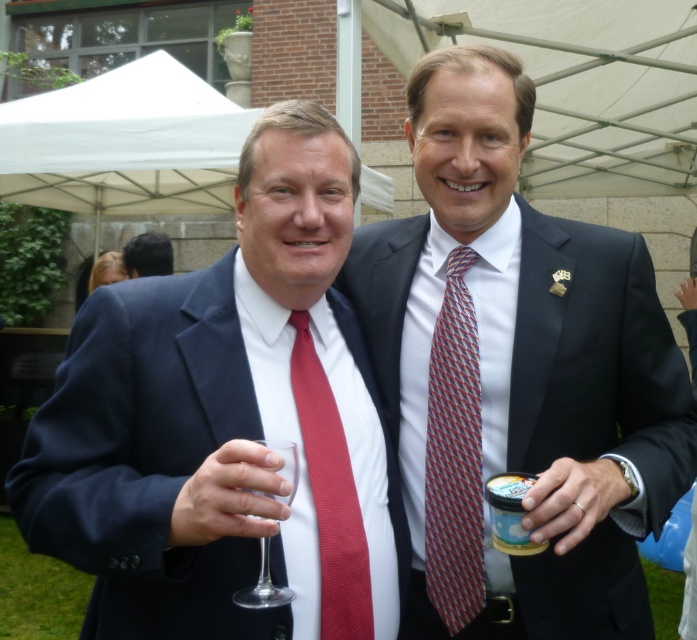
Question: Is matte black suit at center bigger than white plastic cup at right?

Choices:
 (A) yes
 (B) no

Answer: (A)

Question: Which of the following is the farthest from the observer?

Choices:
 (A) matte red tie at left
 (B) multicolored woven tie at center
 (C) white plastic cup at right

Answer: (B)

Question: Is matte red tie at left bigger than matte black suit at center?

Choices:
 (A) no
 (B) yes

Answer: (A)

Question: Which of the following is the closest to the observer?

Choices:
 (A) (305, 461)
 (B) (493, 540)

Answer: (B)

Question: Can you confirm if white plastic cup at right is positioned to the right of dark brown hair at center?

Choices:
 (A) no
 (B) yes

Answer: (B)

Question: Which point appears closest to the camera in this image?

Choices:
 (A) (443, 380)
 (B) (332, 563)
 (C) (158, 234)

Answer: (B)